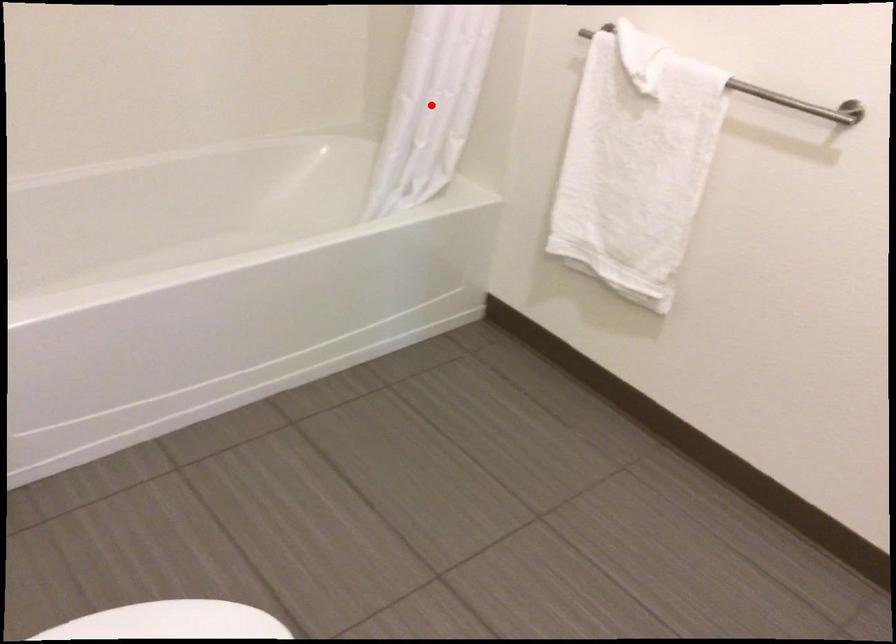
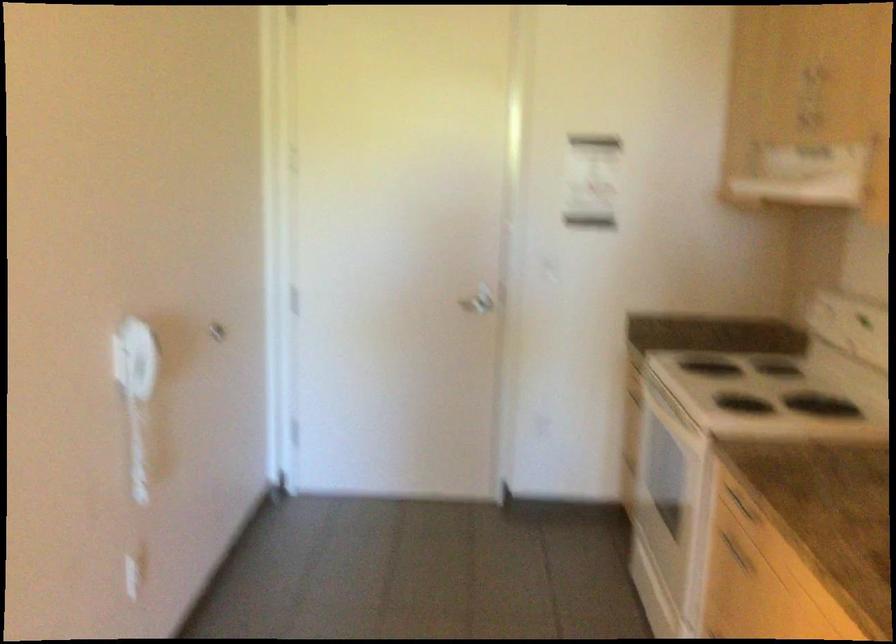
Question: I am providing you with two images of the same scene from different viewpoints. A red point is marked on the first image. Is the red point's position out of view in image 2?

Choices:
 (A) Yes
 (B) No

Answer: (A)